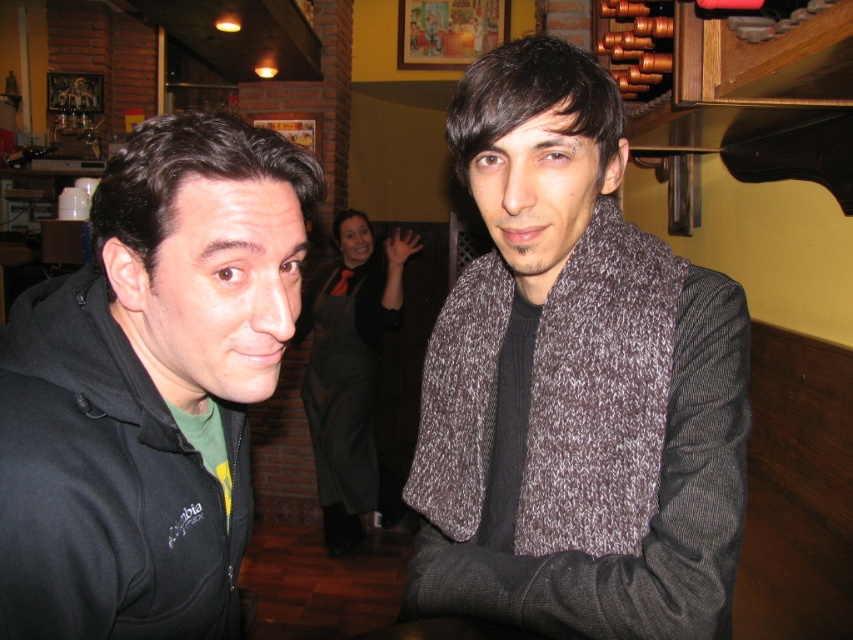
Question: From the image, what is the correct spatial relationship of knitted gray scarf at center in relation to black matte hoodie at left?

Choices:
 (A) above
 (B) below

Answer: (A)

Question: Which point appears closest to the camera in this image?

Choices:
 (A) (228, 164)
 (B) (331, 320)

Answer: (A)

Question: Which object is positioned farthest from the black matte hoodie at left?

Choices:
 (A) black sheer dress at center
 (B) knitted gray scarf at center

Answer: (A)

Question: Which point is farther to the camera?

Choices:
 (A) pos(527,234)
 (B) pos(372,387)
 (C) pos(49,522)

Answer: (B)

Question: Is knitted gray scarf at center to the left of black sheer dress at center from the viewer's perspective?

Choices:
 (A) yes
 (B) no

Answer: (B)

Question: Can you confirm if black matte hoodie at left is wider than black sheer dress at center?

Choices:
 (A) no
 (B) yes

Answer: (A)